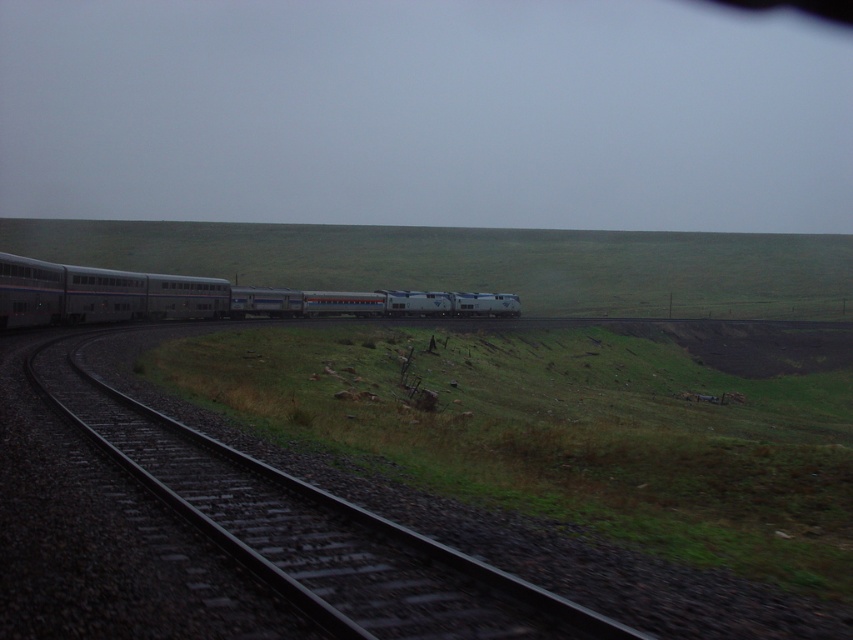
Question: Does black metal track at center have a lesser width compared to silver metallic train at center?

Choices:
 (A) no
 (B) yes

Answer: (B)

Question: Does black metal track at center appear under silver metallic train at center?

Choices:
 (A) no
 (B) yes

Answer: (B)

Question: Which of the following is the closest to the observer?

Choices:
 (A) click(479, 595)
 (B) click(173, 301)

Answer: (A)

Question: Which point is closer to the camera taking this photo?

Choices:
 (A) 549,634
 (B) 503,294

Answer: (A)

Question: Is the position of black metal track at center less distant than that of silver metallic train at center?

Choices:
 (A) no
 (B) yes

Answer: (B)

Question: Which object appears farthest from the camera in this image?

Choices:
 (A) black metal track at center
 (B) silver metallic train at center

Answer: (B)